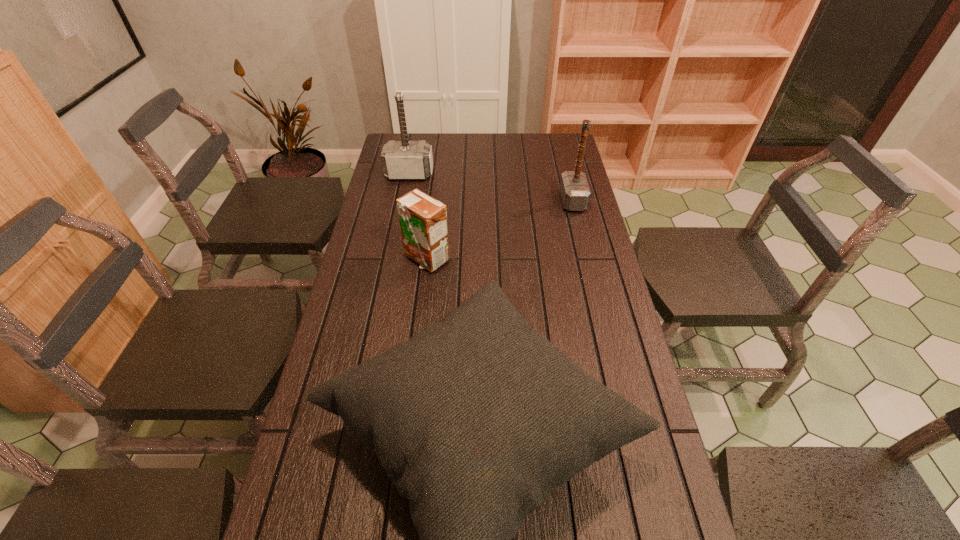
Identify the location of free location located on the straw side of the carton. This screenshot has height=540, width=960. (420, 313).

Find the location of `hammer that is at the left edge`. hammer that is at the left edge is located at coordinates (402, 160).

The image size is (960, 540). Find the location of `carton situated at the left edge`. carton situated at the left edge is located at coordinates (423, 220).

Locate an element on the screen. object that is positioned at the right edge is located at coordinates (575, 193).

I want to click on free spot at the far edge of the desktop, so click(531, 147).

You are a GUI agent. You are given a task and a screenshot of the screen. Output one action in this format:
    pyautogui.click(x=<x>, y=<y>)
    Task: Click on the vacant space at the left edge of the desktop
    Image resolution: width=960 pixels, height=540 pixels.
    Given the screenshot: What is the action you would take?
    pyautogui.click(x=394, y=280)

This screenshot has width=960, height=540. In order to click on vacant area at the right edge of the desktop in this screenshot , I will do `click(564, 234)`.

In order to click on free space at the far left corner of the desktop in this screenshot , I will do `click(397, 135)`.

The width and height of the screenshot is (960, 540). In order to click on vacant area that lies between the nearer hammer and the shortest object in this screenshot , I will do click(x=499, y=230).

You are a GUI agent. You are given a task and a screenshot of the screen. Output one action in this format:
    pyautogui.click(x=<x>, y=<y>)
    Task: Click on the free space between the left hammer and the nearer hammer
    The width and height of the screenshot is (960, 540).
    Given the screenshot: What is the action you would take?
    pyautogui.click(x=492, y=187)